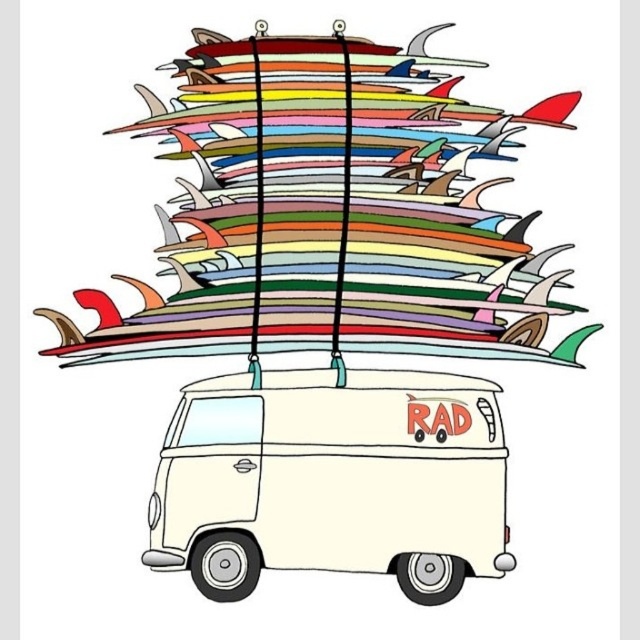
You are planning to load the multicolored surfboards at upper center onto the white matte van at center. Based on their sizes, can the surfboards fit inside the van?

The multicolored surfboards at upper center might be wider than the white matte van at center, so there is a possibility they won not fit inside the van due to their width.

You are a surfer who wants to get to the beach quickly. You see the multicolored surfboards at upper center and the white matte van at center. Which object is closer to the left side of the image?

The multicolored surfboards at upper center are positioned on the left side of the white matte van at center, so they are closer to the left side of the image.